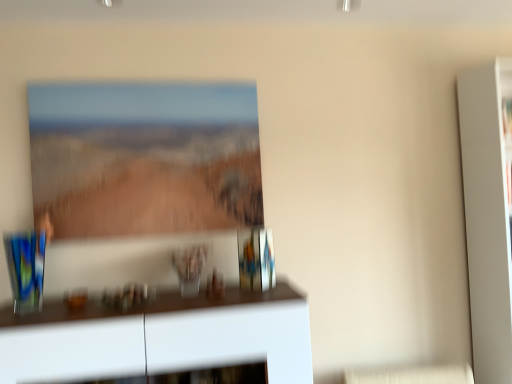
Identify the location of free space on the front side of translucent glass vase at center. (180, 297).